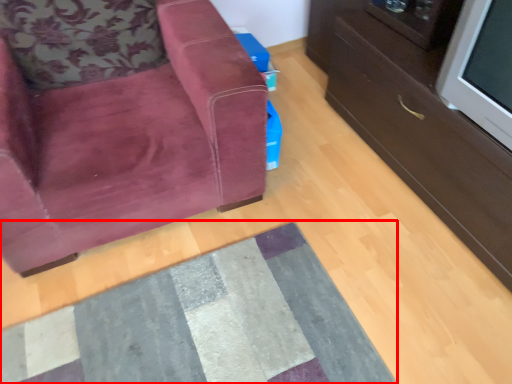
Question: Considering the relative positions of mat (annotated by the red box) and chair in the image provided, where is mat (annotated by the red box) located with respect to the staircase?

Choices:
 (A) right
 (B) left

Answer: (A)